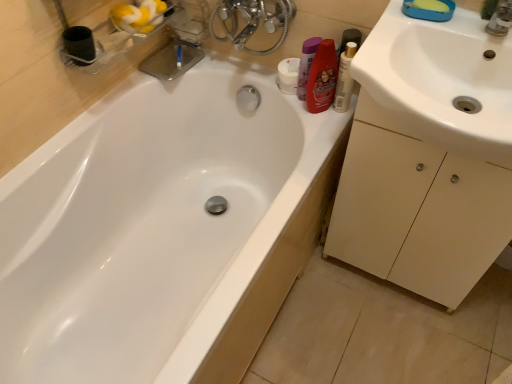
Where is `vacant space in front of shiny red bottle at upper right, which is the third toiletry in left-to-right order`? vacant space in front of shiny red bottle at upper right, which is the third toiletry in left-to-right order is located at coordinates (321, 135).